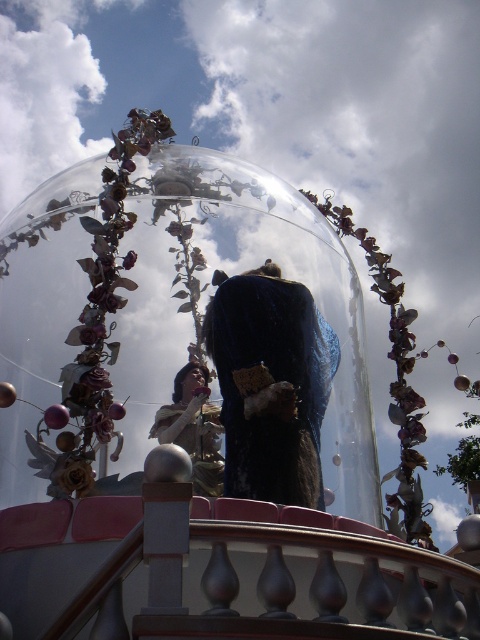
Does velvet-like dark blue coat at center appear on the right side of matte gold dress at center?

Yes, velvet-like dark blue coat at center is to the right of matte gold dress at center.

Consider the image. Can you confirm if velvet-like dark blue coat at center is thinner than matte gold dress at center?

No.

This screenshot has height=640, width=480. Find the location of `velvet-like dark blue coat at center`. velvet-like dark blue coat at center is located at coordinates (271, 385).